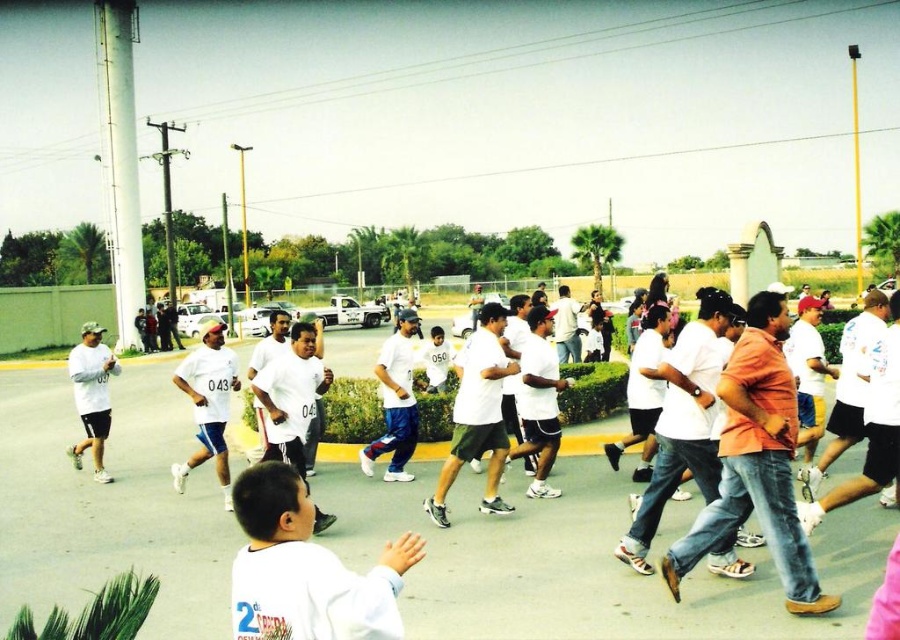
You are a photographer at the race event. You need to take a photo of both the white matte shirt at lower left and the white matte shirt at left. Based on their positions, which shirt should you focus on first to ensure both are in the frame?

The white matte shirt at left is further to the left than the white matte shirt at lower left, so you should focus on the white matte shirt at left first to ensure both are in the frame.

You are a participant in the race and you see two points marked on the map. The first point is at coordinate point (282,509) and the second point is at coordinate point (70,458). Which point is closer to your current position if you are running towards the finish line?

Point (282,509) is in front of point (70,458), so it is closer to your current position when running towards the finish line.

From the picture: You are a photographer trying to capture the boy with the number 2 on his shirt in the lower left corner. The boy is clapping his hands. There is a point at coordinates point (x=306, y=570). Where is this point located on the boy?

The point (x=306, y=570) is located on the white matte shirt at lower left of the boy.